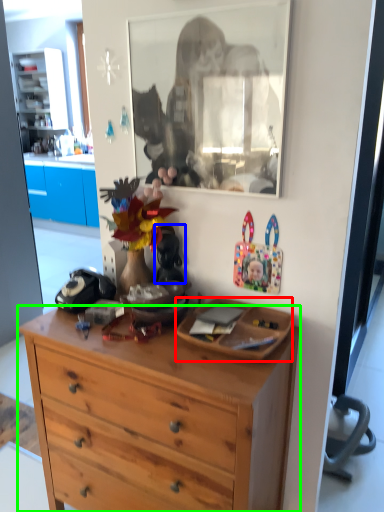
Question: Based on their relative distances, which object is farther from picture frame (highlighted by a red box)? Choose from toy (highlighted by a blue box) and desk (highlighted by a green box).

Choices:
 (A) toy
 (B) desk

Answer: (A)